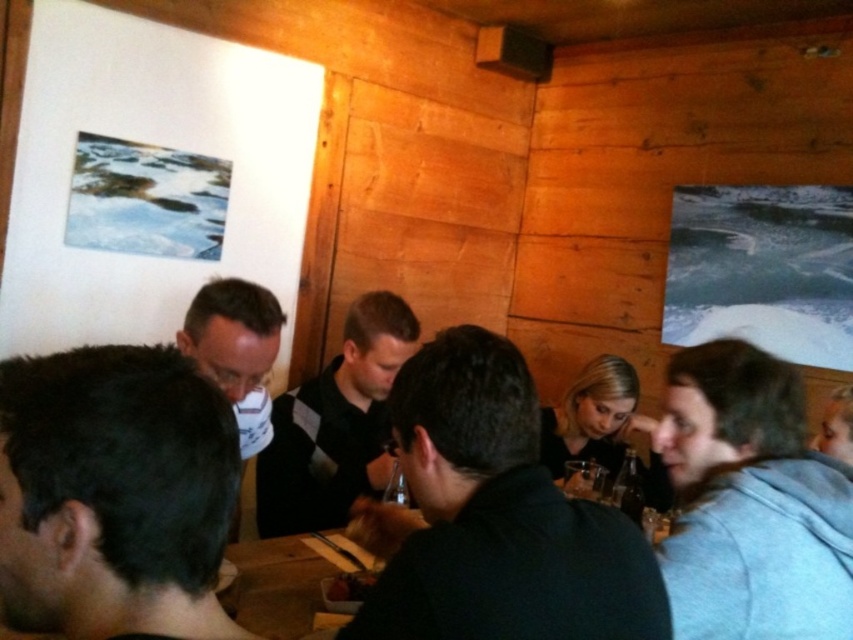
Is dark gray shirt at center wider than dark glass bottle at lower right?

Correct, the width of dark gray shirt at center exceeds that of dark glass bottle at lower right.

Between point (630, 538) and point (637, 496), which one is positioned in front?

Point (630, 538) is more forward.

Identify the location of dark gray shirt at center. This screenshot has width=853, height=640. (492, 516).

Is matte black shirt at center smaller than dark glass bottle at lower right?

Actually, matte black shirt at center might be larger than dark glass bottle at lower right.

Which of these two, matte black shirt at center or dark glass bottle at lower right, stands shorter?

With less height is dark glass bottle at lower right.

What do you see at coordinates (236, 348) in the screenshot?
I see `matte black shirt at center` at bounding box center [236, 348].

The width and height of the screenshot is (853, 640). Identify the location of matte black shirt at center. (236, 348).

In order to click on dark gray shirt at center in this screenshot , I will do `click(492, 516)`.

Between point (636, 572) and point (224, 384), which one is positioned behind?

The point (224, 384) is more distant.

Who is more distant from viewer, (457, 493) or (227, 358)?

The point (227, 358) is behind.

Locate an element on the screen. dark gray shirt at center is located at coordinates (492, 516).